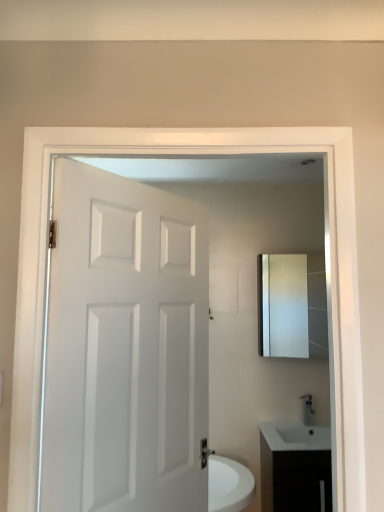
Question: From a real-world perspective, does matte silver medicine cabinet at upper right sit lower than white matte door at center?

Choices:
 (A) no
 (B) yes

Answer: (A)

Question: Is matte silver medicine cabinet at upper right shorter than white matte door at center?

Choices:
 (A) yes
 (B) no

Answer: (A)

Question: Is matte silver medicine cabinet at upper right surrounding white matte door at center?

Choices:
 (A) yes
 (B) no

Answer: (B)

Question: Is matte silver medicine cabinet at upper right at the right side of white matte door at center?

Choices:
 (A) no
 (B) yes

Answer: (B)

Question: Is matte silver medicine cabinet at upper right positioned with its back to white matte door at center?

Choices:
 (A) yes
 (B) no

Answer: (B)

Question: Would you say matte silver medicine cabinet at upper right is a long distance from white matte door at center?

Choices:
 (A) no
 (B) yes

Answer: (B)

Question: Is the surface of white matte door at center in direct contact with satin nickel faucet at lower right?

Choices:
 (A) no
 (B) yes

Answer: (A)

Question: Considering the relative sizes of white matte door at center and satin nickel faucet at lower right in the image provided, is white matte door at center bigger than satin nickel faucet at lower right?

Choices:
 (A) no
 (B) yes

Answer: (B)

Question: Is white matte door at center shorter than satin nickel faucet at lower right?

Choices:
 (A) no
 (B) yes

Answer: (A)

Question: From a real-world perspective, is white matte door at center on top of satin nickel faucet at lower right?

Choices:
 (A) yes
 (B) no

Answer: (A)

Question: From the image's perspective, does white matte door at center appear higher than satin nickel faucet at lower right?

Choices:
 (A) yes
 (B) no

Answer: (A)

Question: Is white matte door at center thinner than satin nickel faucet at lower right?

Choices:
 (A) no
 (B) yes

Answer: (A)

Question: Is matte silver medicine cabinet at upper right aimed at white glossy cabinet at lower right?

Choices:
 (A) yes
 (B) no

Answer: (B)